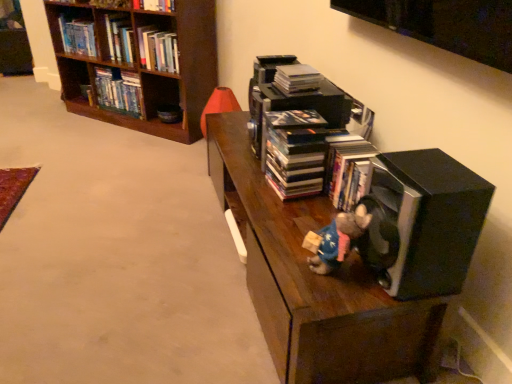
Identify the location of blank space to the left of black matte speaker at lower right. The height and width of the screenshot is (384, 512). pyautogui.click(x=319, y=279).